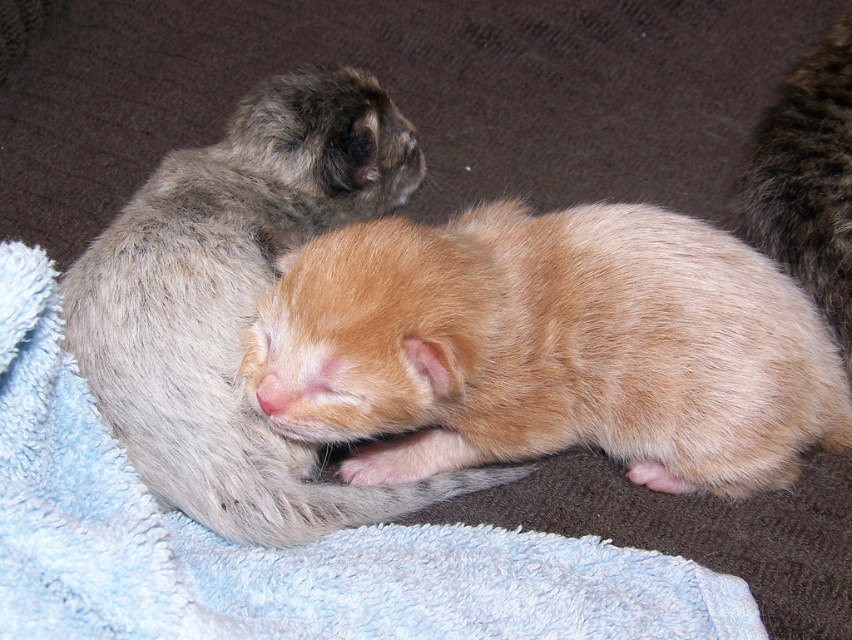
This screenshot has height=640, width=852. What do you see at coordinates (548, 348) in the screenshot? I see `orange fur kitten at center` at bounding box center [548, 348].

Which is behind, point (377, 385) or point (793, 250)?

The point (793, 250) is behind.

What are the coordinates of `orange fur kitten at center` in the screenshot? It's located at (548, 348).

Does fluffy gray kitten at upper left have a greater height compared to fluffy brown fur at upper right?

Yes.

Who is lower down, fluffy gray kitten at upper left or fluffy brown fur at upper right?

fluffy gray kitten at upper left is lower down.

Is point (102, 282) positioned behind point (816, 243)?

That is False.

Where is `fluffy gray kitten at upper left`? This screenshot has height=640, width=852. fluffy gray kitten at upper left is located at coordinates (239, 305).

Does blue terry cloth blanket at lower left have a smaller size compared to fluffy brown fur at upper right?

No.

Which is more to the right, blue terry cloth blanket at lower left or fluffy brown fur at upper right?

Positioned to the right is fluffy brown fur at upper right.

Between point (658, 600) and point (842, 310), which one is positioned behind?

The point (842, 310) is more distant.

At what (x,y) coordinates should I click in order to perform the action: click on blue terry cloth blanket at lower left. Please return your answer as a coordinate pair (x, y). The height and width of the screenshot is (640, 852). Looking at the image, I should click on (278, 548).